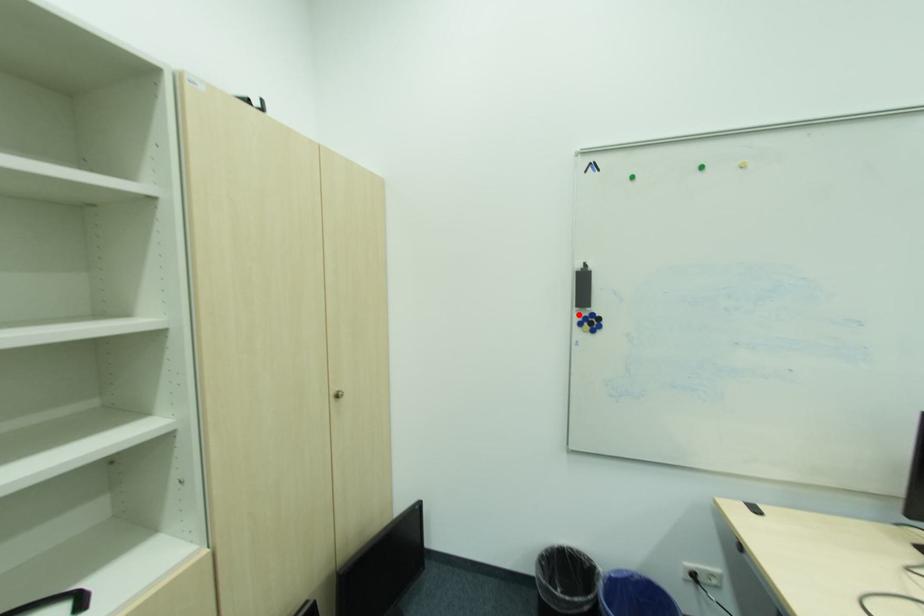
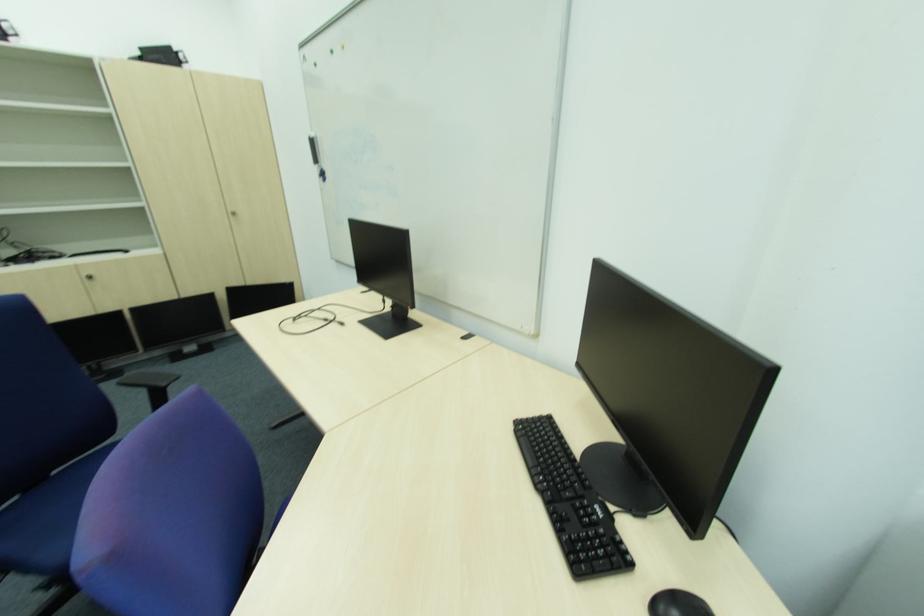
Find the pixel in the second image that matches the highlighted location in the first image.

(322, 172)